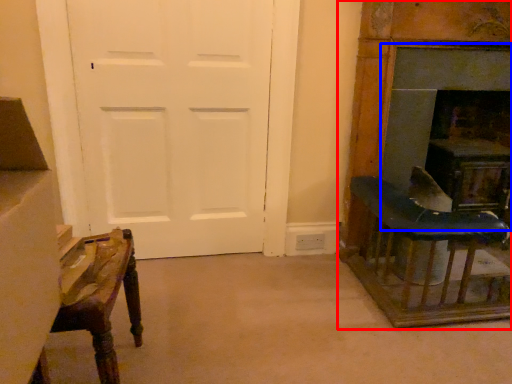
Question: Which of the following is the farthest to the observer, furniture (highlighted by a red box) or fireplace (highlighted by a blue box)?

Choices:
 (A) furniture
 (B) fireplace

Answer: (B)